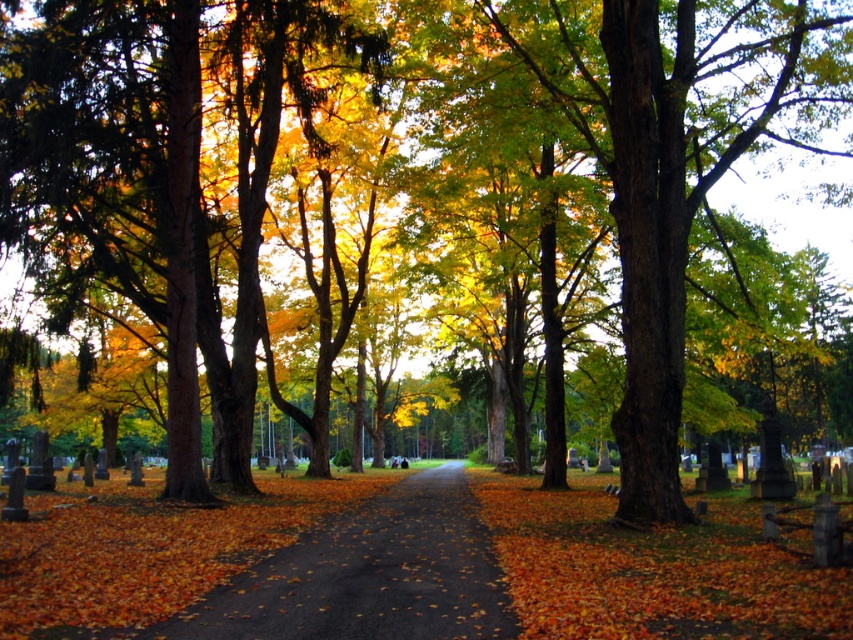
Question: Which point is closer to the camera?

Choices:
 (A) brown asphalt path at center
 (B) golden yellow leaves at left

Answer: (A)

Question: Is golden yellow leaves at left below brown asphalt path at center?

Choices:
 (A) no
 (B) yes

Answer: (A)

Question: Observing the image, what is the correct spatial positioning of golden yellow leaves at left in reference to brown asphalt path at center?

Choices:
 (A) right
 (B) left

Answer: (B)

Question: Is golden yellow leaves at left closer to camera compared to brown asphalt path at center?

Choices:
 (A) no
 (B) yes

Answer: (A)

Question: Which object appears closest to the camera in this image?

Choices:
 (A) golden yellow leaves at left
 (B) brown asphalt path at center

Answer: (B)